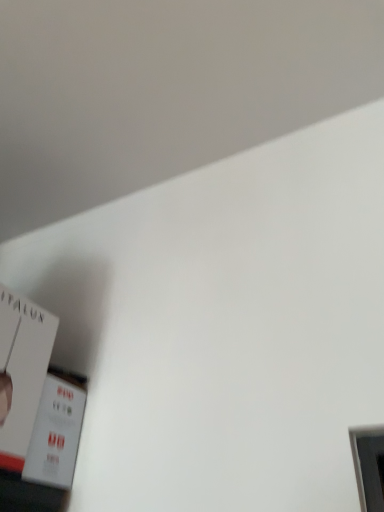
How much space does white matte paper at lower left, the 1th paperback book in the top-to-bottom sequence, occupy vertically?

white matte paper at lower left, the 1th paperback book in the top-to-bottom sequence, is 11.44 inches in height.

The image size is (384, 512). What do you see at coordinates (22, 371) in the screenshot? I see `white matte paper at lower left, placed as the second paperback book when sorted from bottom to top` at bounding box center [22, 371].

Locate an element on the screen. This screenshot has width=384, height=512. white matte paper at lower left, the 1th paperback book in the top-to-bottom sequence is located at coordinates (22, 371).

Find the location of a particular element. Image resolution: width=384 pixels, height=512 pixels. white matte paper at lower left, marked as the first paperback book in a bottom-to-top arrangement is located at coordinates (57, 430).

What do you see at coordinates (57, 430) in the screenshot? I see `white matte paper at lower left, marked as the first paperback book in a bottom-to-top arrangement` at bounding box center [57, 430].

Consider the image. What is the approximate width of white matte paper at lower left, the second paperback book positioned from the top?

white matte paper at lower left, the second paperback book positioned from the top, is 13.64 centimeters wide.

The height and width of the screenshot is (512, 384). What are the coordinates of `white matte paper at lower left, placed as the second paperback book when sorted from bottom to top` in the screenshot? It's located at (22, 371).

Would you say white matte paper at lower left, the 1th paperback book in the top-to-bottom sequence, is to the left or to the right of white matte paper at lower left, the second paperback book positioned from the top, in the picture?

Based on their positions, white matte paper at lower left, the 1th paperback book in the top-to-bottom sequence, is located to the left of white matte paper at lower left, the second paperback book positioned from the top.

Is white matte paper at lower left, placed as the second paperback book when sorted from bottom to top, further to the viewer compared to white matte paper at lower left, the second paperback book positioned from the top?

No, it is not.

Considering the points (16, 437) and (59, 473), which point is behind, point (16, 437) or point (59, 473)?

Point (59, 473)

From the image's perspective, which object appears higher, white matte paper at lower left, the 1th paperback book in the top-to-bottom sequence, or white matte paper at lower left, marked as the first paperback book in a bottom-to-top arrangement?

From the image's view, white matte paper at lower left, the 1th paperback book in the top-to-bottom sequence, is above.

From a real-world perspective, between white matte paper at lower left, placed as the second paperback book when sorted from bottom to top, and white matte paper at lower left, the second paperback book positioned from the top, who is vertically lower?

white matte paper at lower left, the second paperback book positioned from the top.

Looking at their sizes, would you say white matte paper at lower left, the 1th paperback book in the top-to-bottom sequence, is wider or thinner than white matte paper at lower left, marked as the first paperback book in a bottom-to-top arrangement?

In the image, white matte paper at lower left, the 1th paperback book in the top-to-bottom sequence, appears to be wider than white matte paper at lower left, marked as the first paperback book in a bottom-to-top arrangement.

From the picture: Is white matte paper at lower left, the 1th paperback book in the top-to-bottom sequence, taller or shorter than white matte paper at lower left, marked as the first paperback book in a bottom-to-top arrangement?

In the image, white matte paper at lower left, the 1th paperback book in the top-to-bottom sequence, appears to be taller than white matte paper at lower left, marked as the first paperback book in a bottom-to-top arrangement.

Which of these two, white matte paper at lower left, placed as the second paperback book when sorted from bottom to top, or white matte paper at lower left, the second paperback book positioned from the top, is smaller?

white matte paper at lower left, the second paperback book positioned from the top.

Is white matte paper at lower left, marked as the first paperback book in a bottom-to-top arrangement, surrounded by white matte paper at lower left, placed as the second paperback book when sorted from bottom to top?

No, white matte paper at lower left, placed as the second paperback book when sorted from bottom to top, does not contain white matte paper at lower left, marked as the first paperback book in a bottom-to-top arrangement.

Is the surface of white matte paper at lower left, the 1th paperback book in the top-to-bottom sequence, in direct contact with white matte paper at lower left, the second paperback book positioned from the top?

Yes, white matte paper at lower left, the 1th paperback book in the top-to-bottom sequence, is next to white matte paper at lower left, the second paperback book positioned from the top.

Is white matte paper at lower left, placed as the second paperback book when sorted from bottom to top, oriented away from white matte paper at lower left, the second paperback book positioned from the top?

No, white matte paper at lower left, the second paperback book positioned from the top, is not at the back of white matte paper at lower left, placed as the second paperback book when sorted from bottom to top.

Based on the photo, can you tell me how much white matte paper at lower left, the 1th paperback book in the top-to-bottom sequence, and white matte paper at lower left, marked as the first paperback book in a bottom-to-top arrangement, differ in facing direction?

The facing directions of white matte paper at lower left, the 1th paperback book in the top-to-bottom sequence, and white matte paper at lower left, marked as the first paperback book in a bottom-to-top arrangement, are 0.000388 degrees apart.

The image size is (384, 512). I want to click on paperback book lying on the right of white matte paper at lower left, the 1th paperback book in the top-to-bottom sequence, so click(x=57, y=430).

Based on their positions, is white matte paper at lower left, the second paperback book positioned from the top, located to the left or right of white matte paper at lower left, placed as the second paperback book when sorted from bottom to top?

In the image, white matte paper at lower left, the second paperback book positioned from the top, appears on the right side of white matte paper at lower left, placed as the second paperback book when sorted from bottom to top.

Considering the positions of objects white matte paper at lower left, marked as the first paperback book in a bottom-to-top arrangement, and white matte paper at lower left, placed as the second paperback book when sorted from bottom to top, in the image provided, who is in front, white matte paper at lower left, marked as the first paperback book in a bottom-to-top arrangement, or white matte paper at lower left, placed as the second paperback book when sorted from bottom to top,?

white matte paper at lower left, placed as the second paperback book when sorted from bottom to top, is closer to the camera.

Does point (40, 416) come closer to viewer compared to point (5, 289)?

Yes, it is in front of point (5, 289).

In the scene shown: From the image's perspective, would you say white matte paper at lower left, the second paperback book positioned from the top, is shown under white matte paper at lower left, placed as the second paperback book when sorted from bottom to top?

Yes.

From a real-world perspective, is white matte paper at lower left, the second paperback book positioned from the top, beneath white matte paper at lower left, placed as the second paperback book when sorted from bottom to top?

Yes, from a real-world perspective, white matte paper at lower left, the second paperback book positioned from the top, is under white matte paper at lower left, placed as the second paperback book when sorted from bottom to top.

Based on the photo, is white matte paper at lower left, the second paperback book positioned from the top, wider than white matte paper at lower left, the 1th paperback book in the top-to-bottom sequence?

No.

Considering the relative sizes of white matte paper at lower left, the second paperback book positioned from the top, and white matte paper at lower left, the 1th paperback book in the top-to-bottom sequence, in the image provided, is white matte paper at lower left, the second paperback book positioned from the top, taller than white matte paper at lower left, the 1th paperback book in the top-to-bottom sequence,?

No, white matte paper at lower left, the second paperback book positioned from the top, is not taller than white matte paper at lower left, the 1th paperback book in the top-to-bottom sequence.

Based on their sizes in the image, would you say white matte paper at lower left, the second paperback book positioned from the top, is bigger or smaller than white matte paper at lower left, the 1th paperback book in the top-to-bottom sequence?

Considering their sizes, white matte paper at lower left, the second paperback book positioned from the top, takes up less space than white matte paper at lower left, the 1th paperback book in the top-to-bottom sequence.

Would you say white matte paper at lower left, marked as the first paperback book in a bottom-to-top arrangement, is inside or outside white matte paper at lower left, placed as the second paperback book when sorted from bottom to top?

white matte paper at lower left, marked as the first paperback book in a bottom-to-top arrangement, is not enclosed by white matte paper at lower left, placed as the second paperback book when sorted from bottom to top.

Are white matte paper at lower left, marked as the first paperback book in a bottom-to-top arrangement, and white matte paper at lower left, the 1th paperback book in the top-to-bottom sequence, beside each other?

Yes, white matte paper at lower left, marked as the first paperback book in a bottom-to-top arrangement, and white matte paper at lower left, the 1th paperback book in the top-to-bottom sequence, clearly make contact.

Could you tell me if white matte paper at lower left, marked as the first paperback book in a bottom-to-top arrangement, is turned towards white matte paper at lower left, placed as the second paperback book when sorted from bottom to top?

No.

In the scene shown: Can you tell me how much white matte paper at lower left, the second paperback book positioned from the top, and white matte paper at lower left, the 1th paperback book in the top-to-bottom sequence, differ in facing direction?

white matte paper at lower left, the second paperback book positioned from the top, and white matte paper at lower left, the 1th paperback book in the top-to-bottom sequence, are facing 0.000388 degrees away from each other.

How much distance is there between white matte paper at lower left, the second paperback book positioned from the top, and white matte paper at lower left, placed as the second paperback book when sorted from bottom to top?

white matte paper at lower left, the second paperback book positioned from the top, is 2.82 inches from white matte paper at lower left, placed as the second paperback book when sorted from bottom to top.

Where is `paperback book above the white matte paper at lower left, the second paperback book positioned from the top (from a real-world perspective)`? paperback book above the white matte paper at lower left, the second paperback book positioned from the top (from a real-world perspective) is located at coordinates (22, 371).

I want to click on paperback book in front of the white matte paper at lower left, the second paperback book positioned from the top, so click(22, 371).

You are a GUI agent. You are given a task and a screenshot of the screen. Output one action in this format:
    pyautogui.click(x=<x>, y=<y>)
    Task: Click on the paperback book on the right side of white matte paper at lower left, placed as the second paperback book when sorted from bottom to top
    
    Given the screenshot: What is the action you would take?
    pyautogui.click(x=57, y=430)